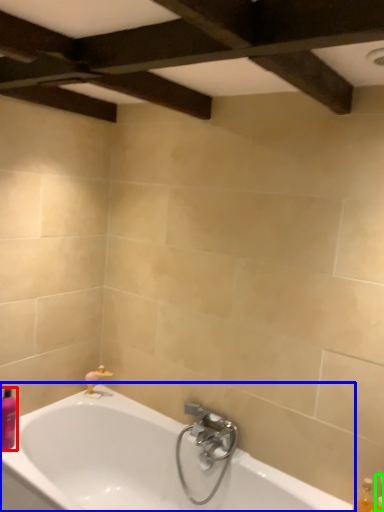
Question: Considering the real-world distances, which object is farthest from toiletry (highlighted by a red box)? bathtub (highlighted by a blue box) or toiletry (highlighted by a green box)?

Choices:
 (A) bathtub
 (B) toiletry

Answer: (B)